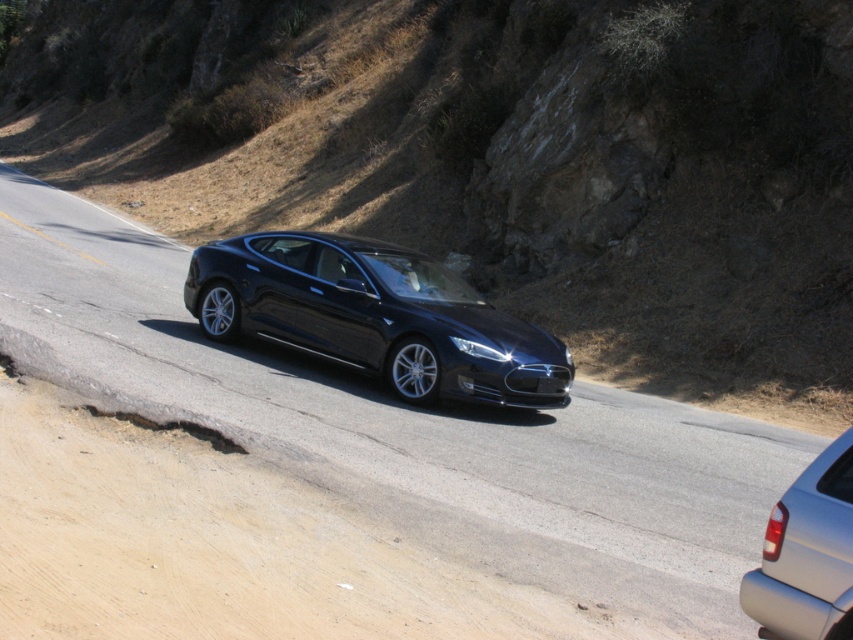
Question: Observing the image, what is the correct spatial positioning of shiny black sedan at center in reference to satin silver sedan at lower right?

Choices:
 (A) below
 (B) above

Answer: (B)

Question: Is satin silver sedan at lower right above black glossy license plate at center?

Choices:
 (A) no
 (B) yes

Answer: (A)

Question: Observing the image, what is the correct spatial positioning of glossy black car at center in reference to shiny black sedan at center?

Choices:
 (A) above
 (B) below

Answer: (B)

Question: Which object is positioned farthest from the shiny black sedan at center?

Choices:
 (A) satin silver sedan at lower right
 (B) dried grass at upper center

Answer: (B)

Question: Which of the following is the farthest from the observer?

Choices:
 (A) (291, 294)
 (B) (459, 381)
 (C) (329, 177)
 (D) (839, 625)

Answer: (C)

Question: Which point appears closest to the camera in this image?

Choices:
 (A) (473, 387)
 (B) (283, 342)
 (C) (596, 481)

Answer: (C)